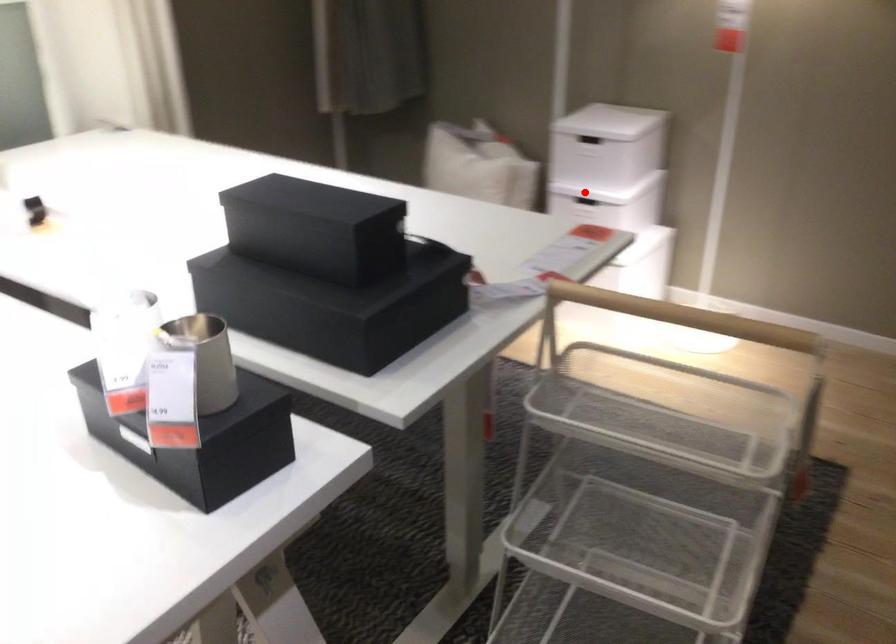
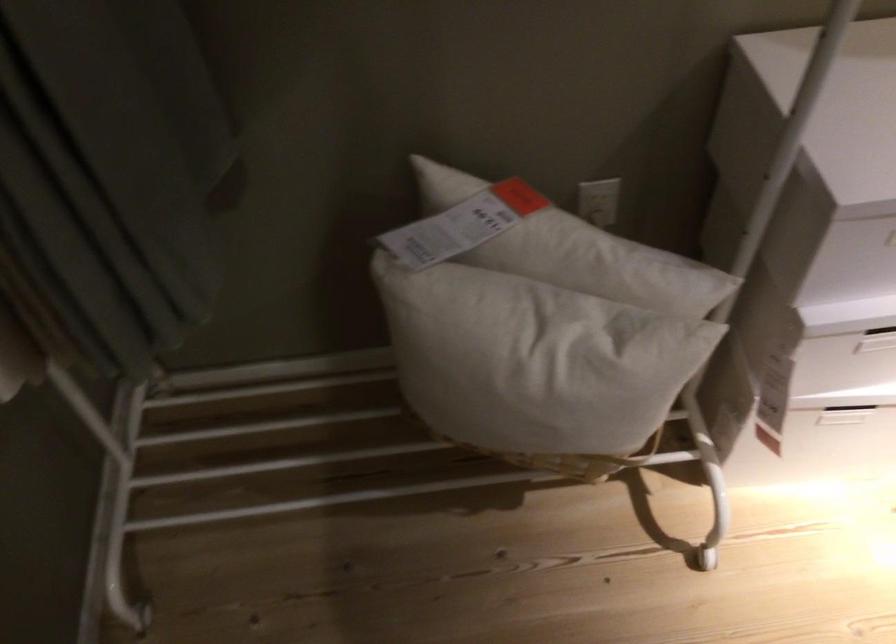
In the second image, find the point that corresponds to the highlighted location in the first image.

(874, 328)